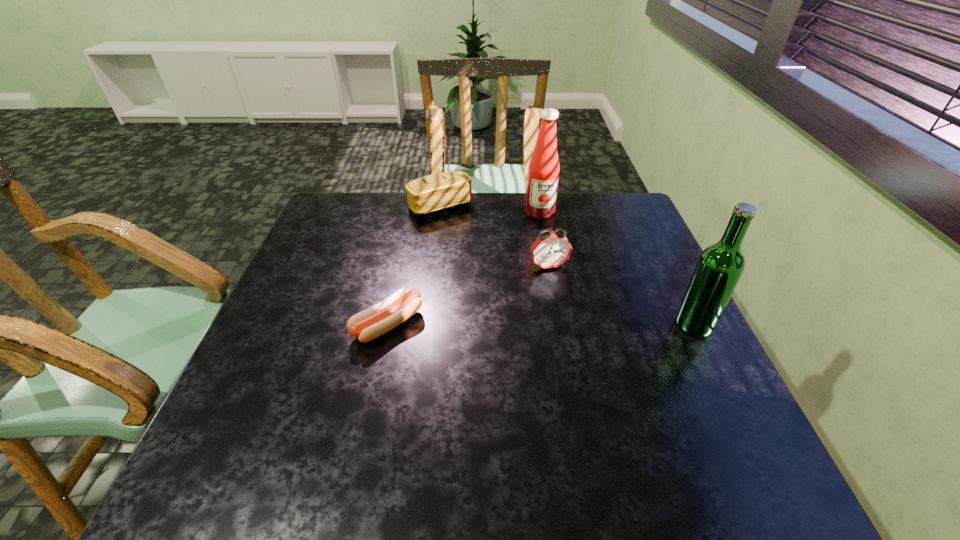
Image resolution: width=960 pixels, height=540 pixels. I want to click on free space between the second shortest object and the rightmost object, so click(x=567, y=265).

At what (x,y) coordinates should I click in order to perform the action: click on free spot between the beer bottle and the shortest object. Please return your answer as a coordinate pair (x, y). Looking at the image, I should click on (541, 324).

Locate an element on the screen. Image resolution: width=960 pixels, height=540 pixels. vacant area that lies between the sausage and the alarm clock is located at coordinates (468, 295).

The height and width of the screenshot is (540, 960). Find the location of `vacant space in between the shortest object and the second shortest object`. vacant space in between the shortest object and the second shortest object is located at coordinates (415, 265).

Where is `empty location between the third shortest object and the rightmost object`? empty location between the third shortest object and the rightmost object is located at coordinates (621, 295).

Locate an element on the screen. Image resolution: width=960 pixels, height=540 pixels. free space between the third tallest object and the second shortest object is located at coordinates point(494,237).

Select which object is the closest to the alarm clock. Please provide its 2D coordinates. Your answer should be formatted as a tuple, i.e. [(x, y)], where the tuple contains the x and y coordinates of a point satisfying the conditions above.

[(543, 172)]

The width and height of the screenshot is (960, 540). I want to click on object that is the third nearest to the condiment, so click(x=375, y=321).

This screenshot has height=540, width=960. Find the location of `free space in the image that satisfies the following two spatial constraints: 1. on the back side of the condiment; 2. on the left side of the alarm clock`. free space in the image that satisfies the following two spatial constraints: 1. on the back side of the condiment; 2. on the left side of the alarm clock is located at coordinates (539, 212).

The image size is (960, 540). What are the coordinates of `vacant space that satisfies the following two spatial constraints: 1. on the front side of the beer bottle; 2. on the right side of the alarm clock` in the screenshot? It's located at (559, 324).